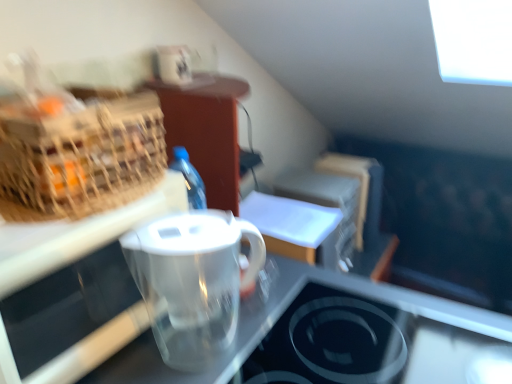
The width and height of the screenshot is (512, 384). What do you see at coordinates (332, 342) in the screenshot?
I see `transparent glass stovetop at lower center` at bounding box center [332, 342].

The image size is (512, 384). I want to click on transparent glass stovetop at lower center, so click(x=332, y=342).

The height and width of the screenshot is (384, 512). In order to click on woven straw picnic basket at left in this screenshot , I will do `click(79, 158)`.

In order to face woven straw picnic basket at left, should I rotate leftwards or rightwards?

Rotate your view left by about 24.922°.

Locate an element on the screen. transparent plastic pitcher at center is located at coordinates (75, 236).

Image resolution: width=512 pixels, height=384 pixels. What are the coordinates of `transparent plastic pitcher at center` in the screenshot? It's located at (193, 281).

The image size is (512, 384). I want to click on transparent glass stovetop at lower center, so click(x=332, y=342).

Is transparent plastic pitcher at center next to transparent glass stovetop at lower center and touching it?

There is a gap between transparent plastic pitcher at center and transparent glass stovetop at lower center.

Where is `appliance in front of the transparent plastic pitcher at center`? Image resolution: width=512 pixels, height=384 pixels. appliance in front of the transparent plastic pitcher at center is located at coordinates (332, 342).

Which of these two, transparent plastic pitcher at center or transparent glass stovetop at lower center, is thinner?

Thinner between the two is transparent plastic pitcher at center.

Can you confirm if woven straw picnic basket at left is taller than transparent glass stovetop at lower center?

Yes, woven straw picnic basket at left is taller than transparent glass stovetop at lower center.

Does woven straw picnic basket at left appear on the right side of transparent glass stovetop at lower center?

No, woven straw picnic basket at left is not to the right of transparent glass stovetop at lower center.

Consider the image. Would you say woven straw picnic basket at left is outside transparent glass stovetop at lower center?

Yes, woven straw picnic basket at left is outside of transparent glass stovetop at lower center.

In terms of height, does woven straw picnic basket at left look taller or shorter compared to transparent plastic pitcher at center?

woven straw picnic basket at left is shorter than transparent plastic pitcher at center.

Where is `picnic basket that appears above the transparent plastic pitcher at center (from a real-world perspective)`? The height and width of the screenshot is (384, 512). picnic basket that appears above the transparent plastic pitcher at center (from a real-world perspective) is located at coordinates coord(79,158).

Consider the image. Are woven straw picnic basket at left and transparent plastic pitcher at center far apart?

No, there isn't a large distance between woven straw picnic basket at left and transparent plastic pitcher at center.

Would you say woven straw picnic basket at left is outside transparent plastic pitcher at center?

Yes, woven straw picnic basket at left is outside of transparent plastic pitcher at center.

Between transparent glass stovetop at lower center and woven straw picnic basket at left, which one appears on the right side from the viewer's perspective?

transparent glass stovetop at lower center is more to the right.

From a real-world perspective, which object rests below the other?

transparent glass stovetop at lower center.

Is transparent glass stovetop at lower center oriented towards woven straw picnic basket at left?

No, transparent glass stovetop at lower center is not turned towards woven straw picnic basket at left.

Who is bigger, transparent glass stovetop at lower center or woven straw picnic basket at left?

woven straw picnic basket at left is bigger.

Which is more to the left, transparent glass stovetop at lower center or transparent plastic pitcher at center?

Positioned to the left is transparent plastic pitcher at center.

Considering the relative sizes of transparent glass stovetop at lower center and transparent plastic pitcher at center in the image provided, is transparent glass stovetop at lower center bigger than transparent plastic pitcher at center?

Incorrect, transparent glass stovetop at lower center is not larger than transparent plastic pitcher at center.

Consider the image. From the image's perspective, is transparent plastic pitcher at center above or below transparent plastic pitcher at center?

transparent plastic pitcher at center is above transparent plastic pitcher at center.

Which object is more forward, transparent plastic pitcher at center or transparent plastic pitcher at center?

transparent plastic pitcher at center is more forward.

Which point is more forward, (176, 354) or (91, 350)?

Point (91, 350)

Is transparent plastic pitcher at center thinner than transparent plastic pitcher at center?

Yes.

Considering the sizes of objects transparent plastic pitcher at center and transparent plastic pitcher at center in the image provided, who is thinner, transparent plastic pitcher at center or transparent plastic pitcher at center?

transparent plastic pitcher at center.

Is transparent plastic pitcher at center looking in the opposite direction of transparent plastic pitcher at center?

No, transparent plastic pitcher at center is not facing the opposite direction of transparent plastic pitcher at center.

Who is shorter, transparent plastic pitcher at center or transparent plastic pitcher at center?

transparent plastic pitcher at center is shorter.

Who is smaller, transparent plastic pitcher at center or transparent plastic pitcher at center?

transparent plastic pitcher at center is smaller.

Find the location of a particular element. appliance beneath the transparent plastic pitcher at center (from a real-world perspective) is located at coordinates (332, 342).

Where is `picnic basket located on the left of transparent glass stovetop at lower center`? The image size is (512, 384). picnic basket located on the left of transparent glass stovetop at lower center is located at coordinates (79, 158).

Considering their positions, is transparent plastic pitcher at center positioned closer to woven straw picnic basket at left than transparent plastic pitcher at center?

transparent plastic pitcher at center is closer to woven straw picnic basket at left.

Which object lies further to the anchor point transparent glass stovetop at lower center, woven straw picnic basket at left or transparent plastic pitcher at center?

woven straw picnic basket at left is further to transparent glass stovetop at lower center.

From the image, which object appears to be nearer to transparent glass stovetop at lower center, transparent plastic pitcher at center or woven straw picnic basket at left?

transparent plastic pitcher at center.

When comparing their distances from transparent plastic pitcher at center, does transparent plastic pitcher at center or woven straw picnic basket at left seem closer?

The object closer to transparent plastic pitcher at center is woven straw picnic basket at left.

Looking at the image, which one is located closer to transparent plastic pitcher at center, transparent plastic pitcher at center or transparent glass stovetop at lower center?

transparent plastic pitcher at center lies closer to transparent plastic pitcher at center than the other object.

Looking at the image, which one is located further to transparent glass stovetop at lower center, transparent plastic pitcher at center or transparent plastic pitcher at center?

transparent plastic pitcher at center is further to transparent glass stovetop at lower center.

Estimate the real-world distances between objects in this image. Which object is closer to transparent plastic pitcher at center, transparent glass stovetop at lower center or woven straw picnic basket at left?

woven straw picnic basket at left is positioned closer to the anchor transparent plastic pitcher at center.

Estimate the real-world distances between objects in this image. Which object is closer to transparent plastic pitcher at center, woven straw picnic basket at left or transparent plastic pitcher at center?

woven straw picnic basket at left.

The width and height of the screenshot is (512, 384). I want to click on coffee cup that lies between woven straw picnic basket at left and transparent plastic pitcher at center from top to bottom, so click(x=193, y=281).

Identify the location of appliance between transparent plastic pitcher at center and transparent plastic pitcher at center in the up-down direction. The width and height of the screenshot is (512, 384). (332, 342).

Locate an element on the screen. The width and height of the screenshot is (512, 384). coffee cup situated between woven straw picnic basket at left and transparent glass stovetop at lower center from left to right is located at coordinates (193, 281).

This screenshot has height=384, width=512. I want to click on appliance between woven straw picnic basket at left and transparent plastic pitcher at center from top to bottom, so click(x=332, y=342).